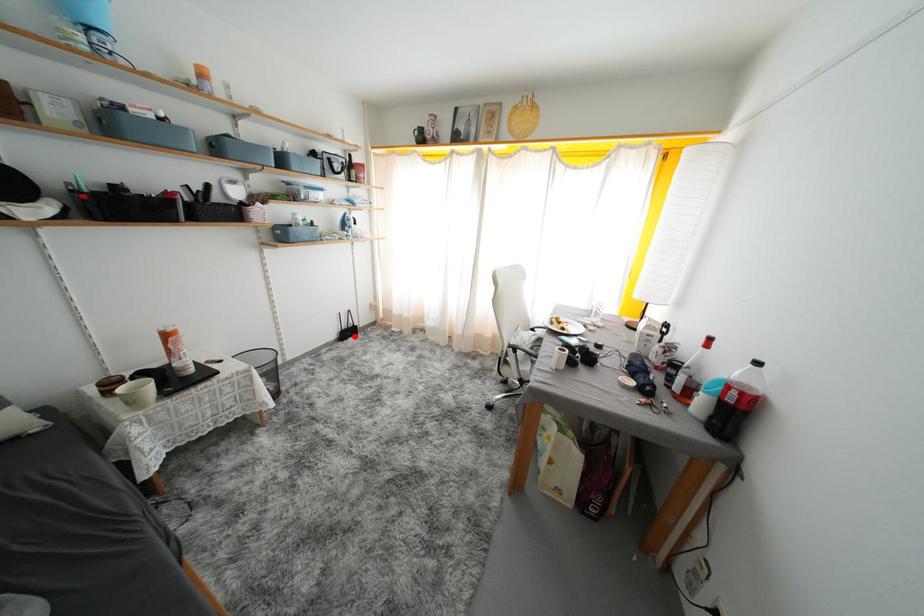
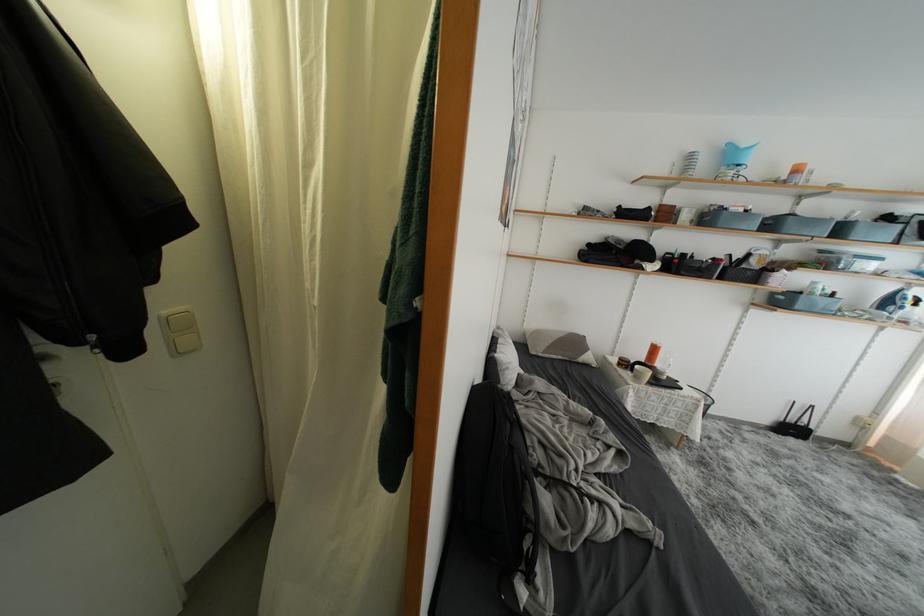
The point at the highlighted location is marked in the first image. Where is the corresponding point in the second image?

(797, 434)